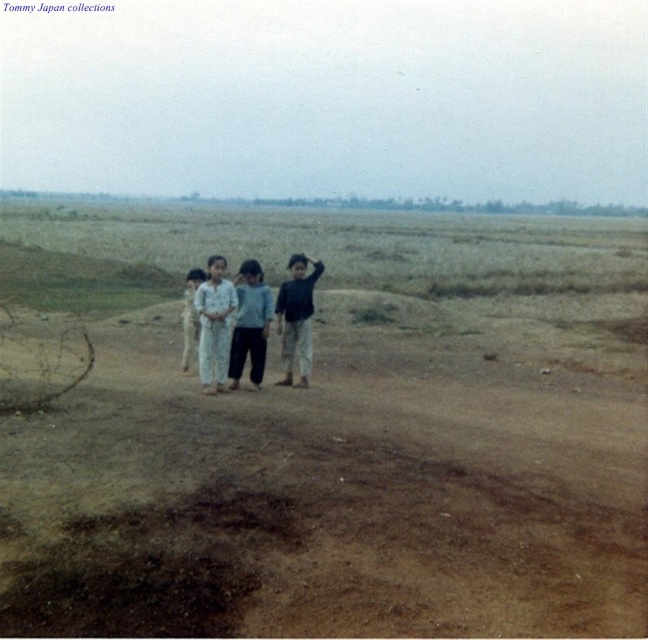
You are a photographer trying to capture a candid shot of the children in the rural scene. You notice the white cotton pants at center and the dark blue shirt at center. Which clothing item is located lower on the body?

The white cotton pants at center are positioned under the dark blue shirt at center, so the white cotton pants at center are lower on the body.

You are a photographer trying to capture the two points in the image. Which point, point (294, 284) or point (268, 296), is closer to your camera lens?

Point (294, 284) is further to the viewer than point (268, 296), so the point closer to the camera lens is point (268, 296).